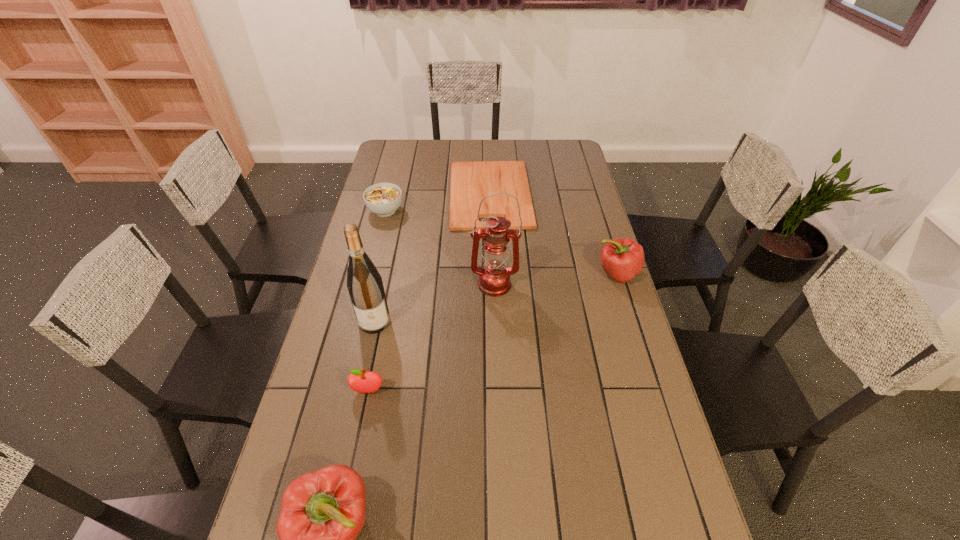
Locate an element on the screen. The image size is (960, 540). vacant space at the near edge of the desktop is located at coordinates (451, 512).

Identify the location of vacant space at the left edge of the desktop. point(359,448).

In the image, there is a desktop. At what (x,y) coordinates should I click in order to perform the action: click on vacant space at the right edge. Please return your answer as a coordinate pair (x, y). This screenshot has height=540, width=960. Looking at the image, I should click on (628, 322).

Where is `vacant space that is in between the oil lamp and the fifth farthest object`? vacant space that is in between the oil lamp and the fifth farthest object is located at coordinates (434, 303).

I want to click on empty location between the third shortest object and the chopping board, so click(x=429, y=293).

This screenshot has height=540, width=960. Find the location of `empty space between the third nearest object and the sixth tallest object`. empty space between the third nearest object and the sixth tallest object is located at coordinates (380, 266).

Locate which object ranks third in proximity to the nearer bell pepper. Please provide its 2D coordinates. Your answer should be formatted as a tuple, i.e. [(x, y)], where the tuple contains the x and y coordinates of a point satisfying the conditions above.

[(494, 278)]

At what (x,y) coordinates should I click in order to perform the action: click on the third closest object relative to the rightmost object. Please return your answer as a coordinate pair (x, y). Looking at the image, I should click on (364, 283).

Locate an element on the screen. This screenshot has height=540, width=960. free location that satisfies the following two spatial constraints: 1. on the front side of the fifth farthest object; 2. on the left side of the apple is located at coordinates (359, 391).